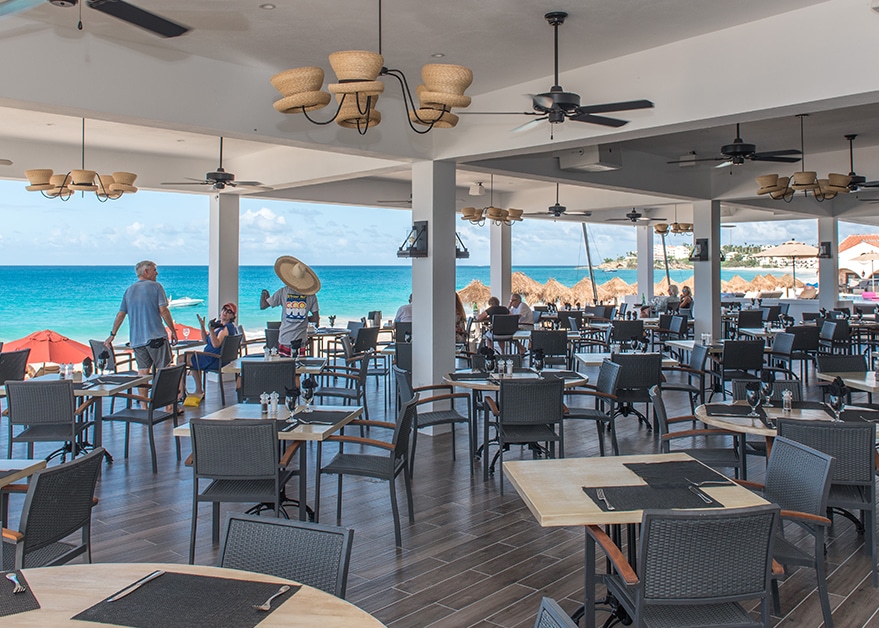
Locate an element on the screen. chair is located at coordinates point(747,355).